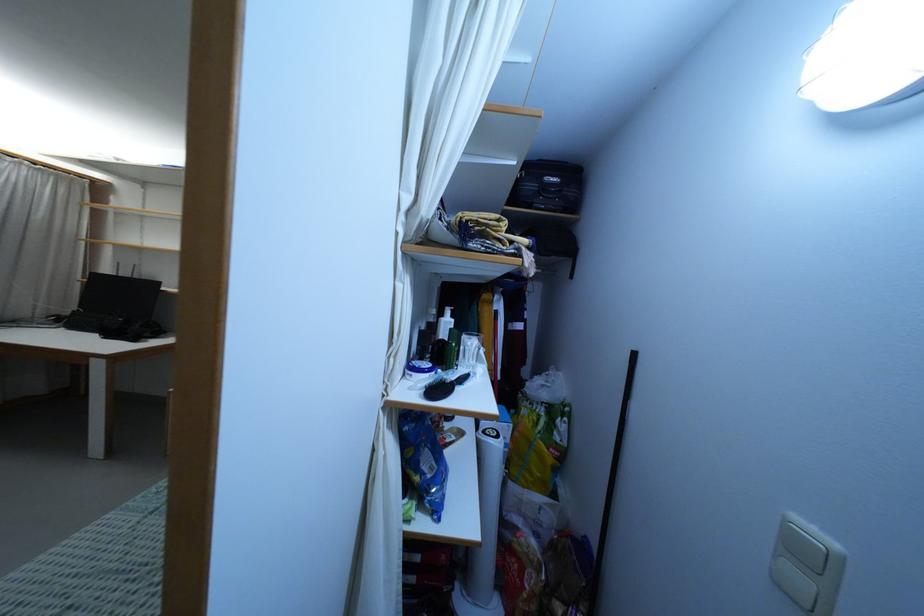
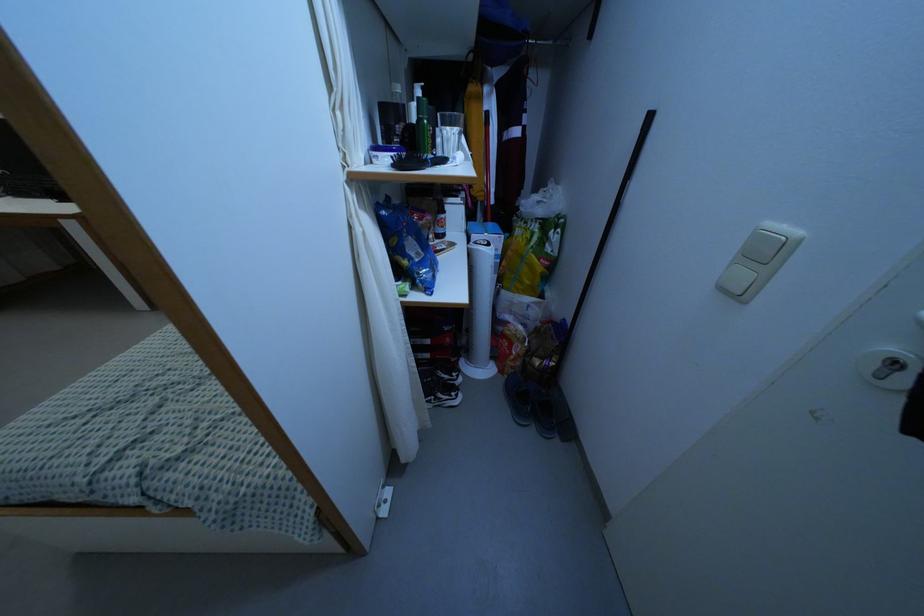
Find the pixel in the second image that matches point (809, 557) in the first image.

(762, 254)